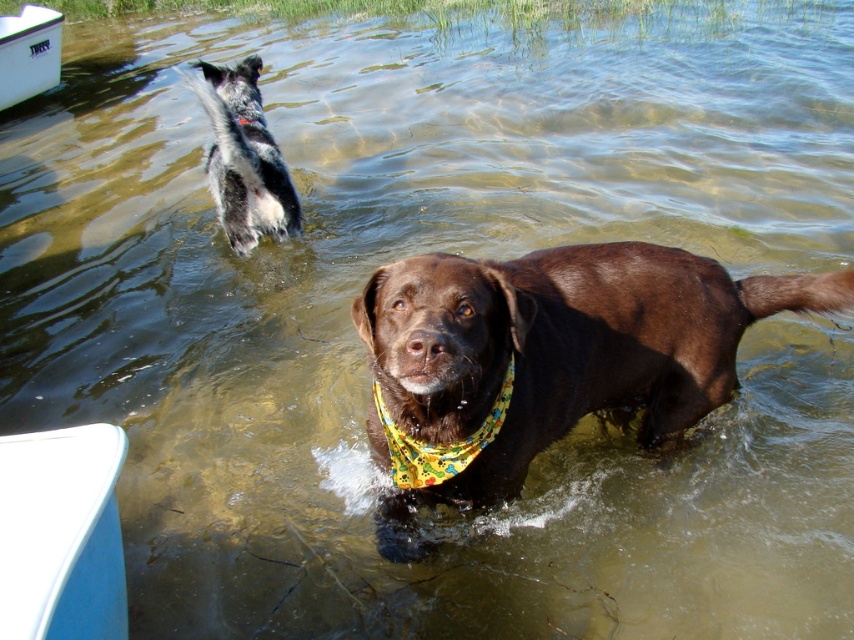
Is brown matte dog at center behind white plastic boat at lower left?

That is True.

Who is taller, brown matte dog at center or white plastic boat at lower left?

brown matte dog at center

Is point (588, 316) positioned before point (9, 481)?

No, (588, 316) is further to viewer.

I want to click on brown matte dog at center, so pyautogui.click(x=548, y=356).

Is white plastic boat at lower left to the left of black and white fur at upper left from the viewer's perspective?

No, white plastic boat at lower left is not to the left of black and white fur at upper left.

Is white plastic boat at lower left wider than black and white fur at upper left?

In fact, white plastic boat at lower left might be narrower than black and white fur at upper left.

Where is `white plastic boat at lower left`? white plastic boat at lower left is located at coordinates (61, 534).

The image size is (854, 640). In order to click on white plastic boat at lower left in this screenshot , I will do `click(61, 534)`.

Which is more to the right, white plastic boat at lower left or yellow fabric bandana at center?

yellow fabric bandana at center

What do you see at coordinates (61, 534) in the screenshot?
I see `white plastic boat at lower left` at bounding box center [61, 534].

Is point (25, 476) closer to camera compared to point (459, 442)?

Yes, it is in front of point (459, 442).

Locate an element on the screen. Image resolution: width=854 pixels, height=640 pixels. white plastic boat at lower left is located at coordinates (61, 534).